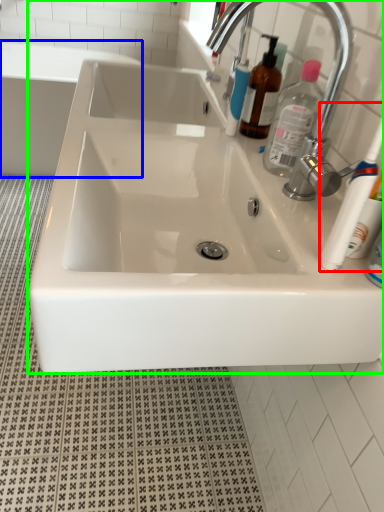
Question: Based on their relative distances, which object is farther from toothbrush (highlighted by a red box)? Choose from bath (highlighted by a blue box) and sink (highlighted by a green box).

Choices:
 (A) bath
 (B) sink

Answer: (A)